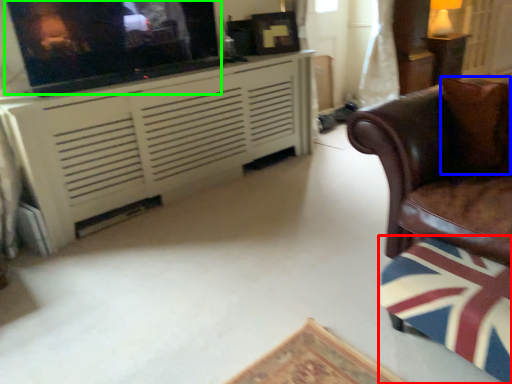
Question: Based on their relative distances, which object is farther from swivel chair (highlighted by a red box)? Choose from pillow (highlighted by a blue box) and tv show (highlighted by a green box).

Choices:
 (A) pillow
 (B) tv show

Answer: (B)